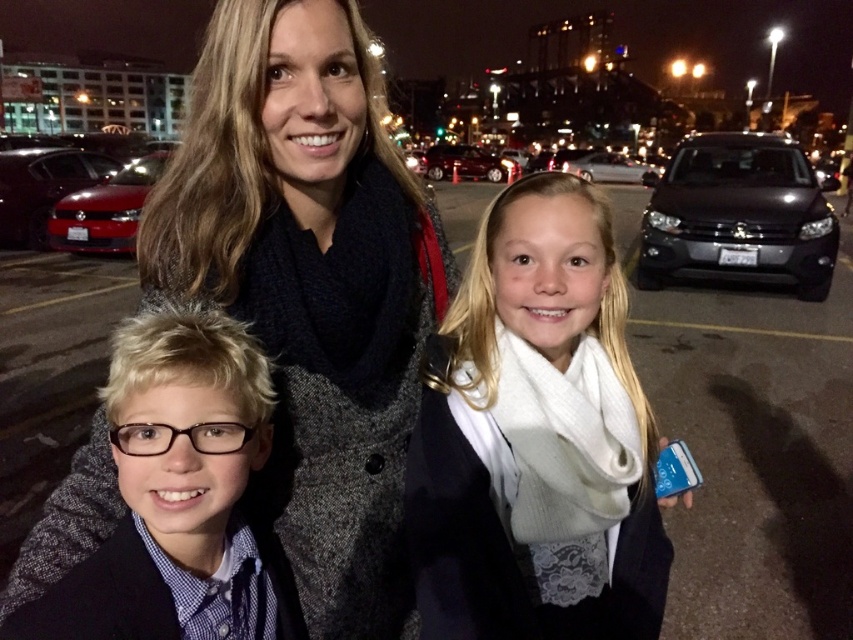
Based on the photo, is black metallic car at right in front of shiny red sedan at center?

Yes.

Who is positioned more to the left, black metallic car at right or shiny red sedan at center?

From the viewer's perspective, shiny red sedan at center appears more on the left side.

Does point (793, 280) come farther from viewer compared to point (463, 148)?

That is False.

Locate an element on the screen. This screenshot has height=640, width=853. black metallic car at right is located at coordinates (738, 214).

Which is above, shiny red sedan at left or shiny red sedan at center?

shiny red sedan at center

Which is in front, point (42, 216) or point (426, 170)?

Point (42, 216) is in front.

This screenshot has width=853, height=640. Identify the location of shiny red sedan at left. (42, 188).

Does black metallic car at right have a larger size compared to white glossy sedan at center?

No, black metallic car at right is not bigger than white glossy sedan at center.

Does point (698, 208) lie behind point (601, 154)?

No.

This screenshot has height=640, width=853. What are the coordinates of `black metallic car at right` in the screenshot? It's located at (738, 214).